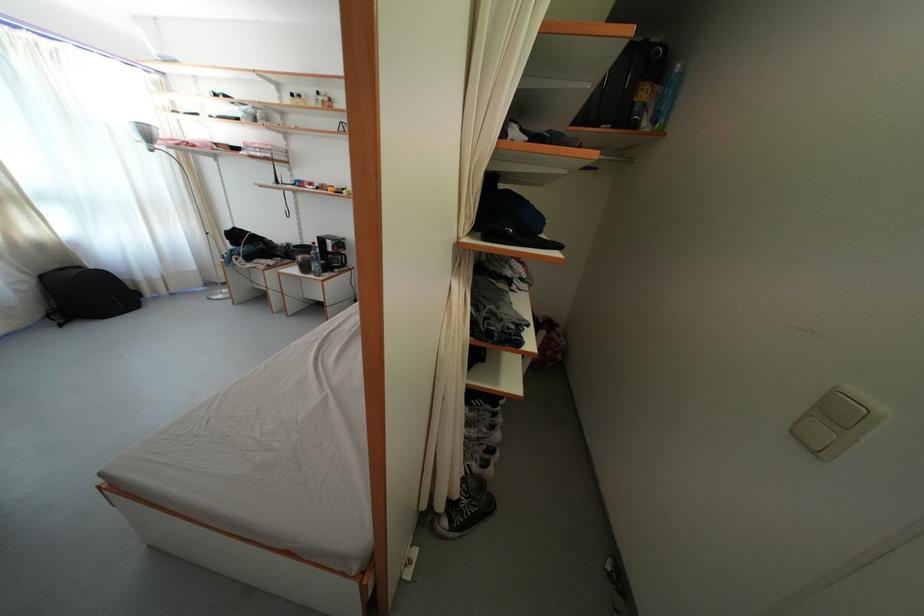
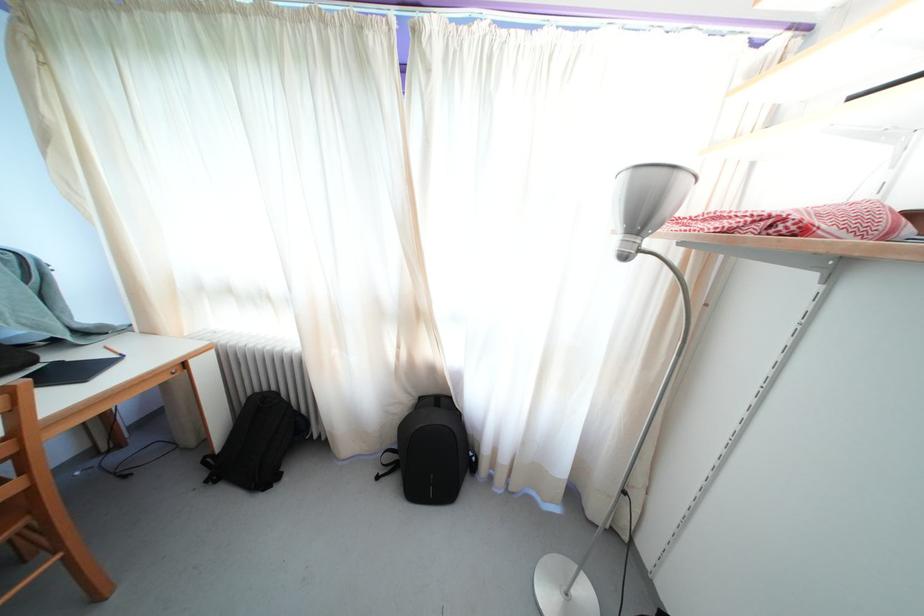
Find the pixel in the second image that matches point (155, 144) in the first image.

(648, 223)